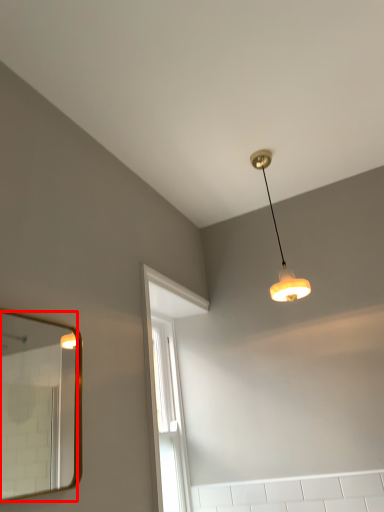
Question: From the image's perspective, what is the correct spatial relationship of mirror (annotated by the red box) in relation to lamp?

Choices:
 (A) below
 (B) above

Answer: (A)